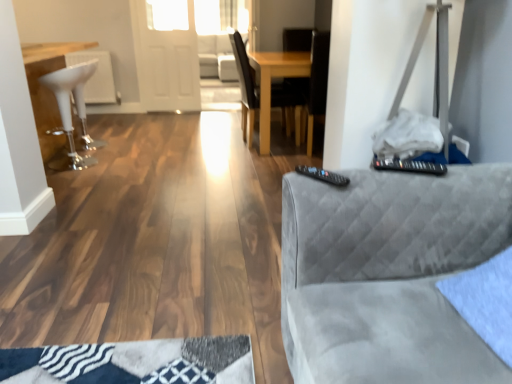
Locate an element on the screen. This screenshot has width=512, height=384. black plastic remote at upper right is located at coordinates (409, 166).

I want to click on transparent glass door at upper center, so (x=166, y=59).

Identify the location of white fabric couch at center. (217, 57).

At what (x,y) coordinates should I click in order to perform the action: click on wooden chair at center. Please return your answer as a coordinate pair (x, y). The width and height of the screenshot is (512, 384). Looking at the image, I should click on (265, 86).

Between point (252, 77) and point (25, 49), which one is positioned behind?

Point (252, 77)

Would you say wooden chair at center is a long distance from white glossy bar stool at left?

wooden chair at center is positioned a significant distance from white glossy bar stool at left.

From the image's perspective, is wooden chair at center on white glossy bar stool at left?

Correct, wooden chair at center appears higher than white glossy bar stool at left in the image.

In terms of height, does wooden chair at center look taller or shorter compared to white glossy bar stool at left?

In the image, wooden chair at center appears to be taller than white glossy bar stool at left.

From a real-world perspective, is suede gray couch at right located higher than white glossy bar stool at left?

Indeed, from a real-world perspective, suede gray couch at right stands above white glossy bar stool at left.

Does point (470, 334) come farther from viewer compared to point (87, 164)?

No, it is not.

Can you confirm if suede gray couch at right is wider than white glossy bar stool at left?

Indeed, suede gray couch at right has a greater width compared to white glossy bar stool at left.

Is suede gray couch at right behind white glossy bar stool at left?

No, the depth of suede gray couch at right is less than that of white glossy bar stool at left.

Is black plastic remote at right outside of wooden chair at center?

Absolutely, black plastic remote at right is external to wooden chair at center.

Is the depth of black plastic remote at right greater than that of wooden chair at center?

No.

Is black plastic remote at right oriented away from wooden chair at center?

No.

From a real-world perspective, is black plastic remote at right above or below wooden chair at center?

black plastic remote at right is situated higher than wooden chair at center in the real world.

Considering the positions of objects white fabric couch at center and white glossy bar stool at left in the image provided, who is more to the left, white fabric couch at center or white glossy bar stool at left?

From the viewer's perspective, white glossy bar stool at left appears more on the left side.

Can you confirm if white fabric couch at center is smaller than white glossy bar stool at left?

Actually, white fabric couch at center might be larger than white glossy bar stool at left.

From the image's perspective, does white fabric couch at center appear lower than white glossy bar stool at left?

No.

Consider the image. Is white fabric couch at center positioned with its back to white glossy bar stool at left?

No, white fabric couch at center's orientation is not away from white glossy bar stool at left.

Is suede gray couch at right behind white fabric couch at center?

That is False.

From the image's perspective, does suede gray couch at right appear higher than white fabric couch at center?

No, from the image's perspective, suede gray couch at right is not over white fabric couch at center.

Considering the relative sizes of suede gray couch at right and white fabric couch at center in the image provided, is suede gray couch at right wider than white fabric couch at center?

In fact, suede gray couch at right might be narrower than white fabric couch at center.

From a real-world perspective, between suede gray couch at right and black plastic remote at upper right, who is vertically lower?

suede gray couch at right, from a real-world perspective.

Could you tell me if suede gray couch at right is turned towards black plastic remote at upper right?

No, suede gray couch at right does not turn towards black plastic remote at upper right.

Can you see suede gray couch at right touching black plastic remote at upper right?

No, suede gray couch at right is not in contact with black plastic remote at upper right.

The image size is (512, 384). Find the location of `control to the left of suede gray couch at right`. control to the left of suede gray couch at right is located at coordinates (409, 166).

You are a GUI agent. You are given a task and a screenshot of the screen. Output one action in this format:
    pyautogui.click(x=<x>, y=<y>)
    Task: Click on the glass door on the left of the wooden chair at center
    The image size is (512, 384).
    Given the screenshot: What is the action you would take?
    pyautogui.click(x=166, y=59)

Measure the distance between transparent glass door at upper center and wooden chair at center.

transparent glass door at upper center and wooden chair at center are 5.07 feet apart from each other.

Is point (175, 41) closer or farther from the camera than point (247, 132)?

Point (175, 41) appears to be farther away from the viewer than point (247, 132).

Which of these two, transparent glass door at upper center or wooden chair at center, stands shorter?

Answer: wooden chair at center.

Find the location of a particular element. This screenshot has width=512, height=384. table below the wooden chair at center (from a real-world perspective) is located at coordinates (47, 90).

The height and width of the screenshot is (384, 512). What are the coordinates of `table above the suede gray couch at right (from the image's perspective)` in the screenshot? It's located at (47, 90).

Which object lies nearer to the anchor point black plastic remote at upper right, transparent glass door at upper center or suede gray couch at right?

suede gray couch at right lies closer to black plastic remote at upper right than the other object.

Looking at the image, which one is located closer to wooden chair at center, white fabric couch at center or suede gray couch at right?

white fabric couch at center is closer to wooden chair at center.

From the image, which object appears to be nearer to black plastic remote at right, suede gray couch at right or white fabric couch at center?

Among the two, suede gray couch at right is located nearer to black plastic remote at right.

Looking at the image, which one is located further to wooden chair at center, white fabric couch at center or transparent glass door at upper center?

white fabric couch at center lies further to wooden chair at center than the other object.

Which object lies further to the anchor point suede gray couch at right, black plastic remote at right or white fabric couch at center?

Based on the image, white fabric couch at center appears to be further to suede gray couch at right.

Which object lies further to the anchor point white glossy bar stool at left, black plastic remote at right or white fabric couch at center?

white fabric couch at center is further to white glossy bar stool at left.

When comparing their distances from black plastic remote at upper right, does suede gray couch at right or white fabric couch at center seem closer?

Based on the image, suede gray couch at right appears to be nearer to black plastic remote at upper right.

In the scene shown: Which object lies nearer to the anchor point black plastic remote at right, black plastic remote at upper right or transparent glass door at upper center?

black plastic remote at upper right is positioned closer to the anchor black plastic remote at right.

At what (x,y) coordinates should I click in order to perform the action: click on glass door between black plastic remote at upper right and white fabric couch at center in the front-back direction. Please return your answer as a coordinate pair (x, y). Looking at the image, I should click on (166, 59).

You are a GUI agent. You are given a task and a screenshot of the screen. Output one action in this format:
    pyautogui.click(x=<x>, y=<y>)
    Task: Click on the chair located between black plastic remote at right and transparent glass door at upper center in the depth direction
    
    Given the screenshot: What is the action you would take?
    pyautogui.click(x=265, y=86)

You are a GUI agent. You are given a task and a screenshot of the screen. Output one action in this format:
    pyautogui.click(x=<x>, y=<y>)
    Task: Click on the remote situated between white glossy bar stool at left and black plastic remote at upper right from left to right
    This screenshot has height=384, width=512.
    Given the screenshot: What is the action you would take?
    pyautogui.click(x=323, y=175)

What are the coordinates of `control located between suede gray couch at right and white glossy bar stool at left in the depth direction` in the screenshot? It's located at (409, 166).